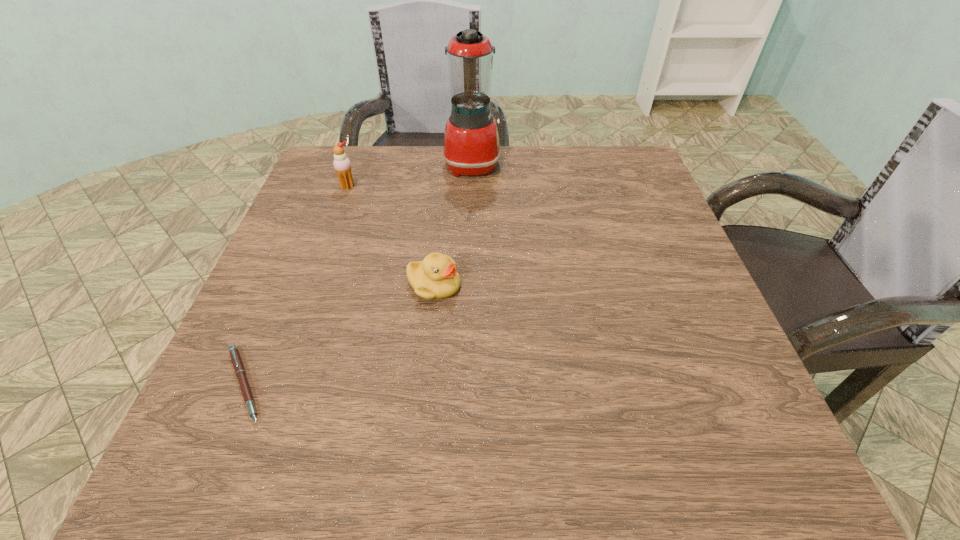
In the image, there is a desktop. Where is `free space at the right edge`? This screenshot has width=960, height=540. free space at the right edge is located at coordinates (681, 291).

This screenshot has height=540, width=960. I want to click on vacant space at the far left corner of the desktop, so click(x=315, y=199).

In the image, there is a desktop. What are the coordinates of `vacant space at the near left corner` in the screenshot? It's located at (276, 438).

At what (x,y) coordinates should I click in order to perform the action: click on free space at the far right corner. Please return your answer as a coordinate pair (x, y). Looking at the image, I should click on (645, 197).

In order to click on vacant position at the near right corner of the desktop in this screenshot , I will do `click(747, 429)`.

Find the location of a particular element. free spot between the pen and the tallest object is located at coordinates pyautogui.click(x=358, y=274).

The width and height of the screenshot is (960, 540). I want to click on unoccupied area between the third tallest object and the farthest object, so click(x=453, y=225).

Locate an element on the screen. This screenshot has height=540, width=960. free space between the food processor and the third nearest object is located at coordinates (410, 176).

At what (x,y) coordinates should I click in order to perform the action: click on vacant space in between the third shortest object and the farthest object. Please return your answer as a coordinate pair (x, y). The image size is (960, 540). Looking at the image, I should click on (410, 176).

What are the coordinates of `blank region between the second farthest object and the farthest object` in the screenshot? It's located at (410, 176).